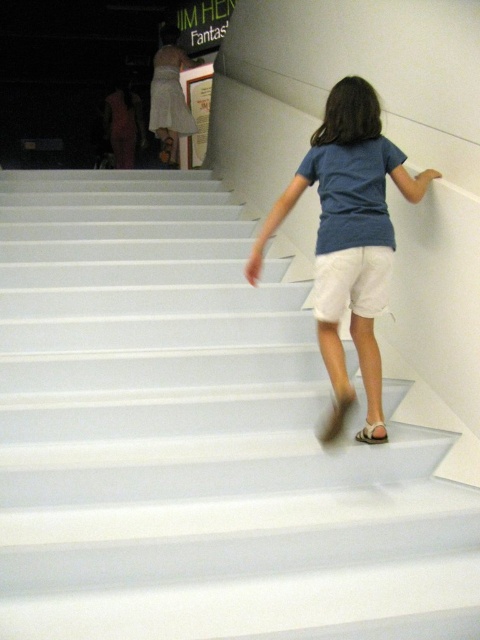
Which is more to the right, blue cotton shirt at center or white fabric sandal at lower center?

From the viewer's perspective, white fabric sandal at lower center appears more on the right side.

Can you confirm if blue cotton shirt at center is positioned to the right of white fabric sandal at lower center?

Incorrect, blue cotton shirt at center is not on the right side of white fabric sandal at lower center.

Locate an element on the screen. This screenshot has height=640, width=480. blue cotton shirt at center is located at coordinates click(347, 179).

Image resolution: width=480 pixels, height=640 pixels. What are the coordinates of `blue cotton shirt at center` in the screenshot? It's located at (347, 179).

Can you confirm if white glossy stairs at center is smaller than white fabric sandal at lower center?

No, white glossy stairs at center is not smaller than white fabric sandal at lower center.

Is white glossy stairs at center shorter than white fabric sandal at lower center?

In fact, white glossy stairs at center may be taller than white fabric sandal at lower center.

Find the location of `white glossy stairs at center`. white glossy stairs at center is located at coordinates tap(195, 438).

The width and height of the screenshot is (480, 640). Identify the location of white glossy stairs at center. (195, 438).

What do you see at coordinates (195, 438) in the screenshot?
I see `white glossy stairs at center` at bounding box center [195, 438].

Which of these two, white glossy stairs at center or white cotton shorts at center, stands shorter?

With less height is white cotton shorts at center.

Who is more forward, [229,211] or [389,260]?

Positioned in front is point [389,260].

The image size is (480, 640). Find the location of `white glossy stairs at center`. white glossy stairs at center is located at coordinates (195, 438).